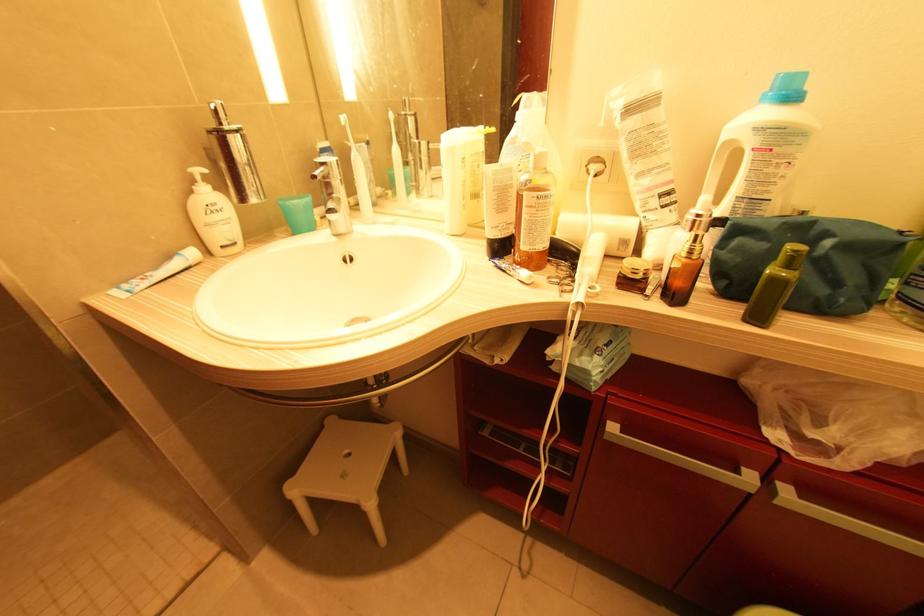
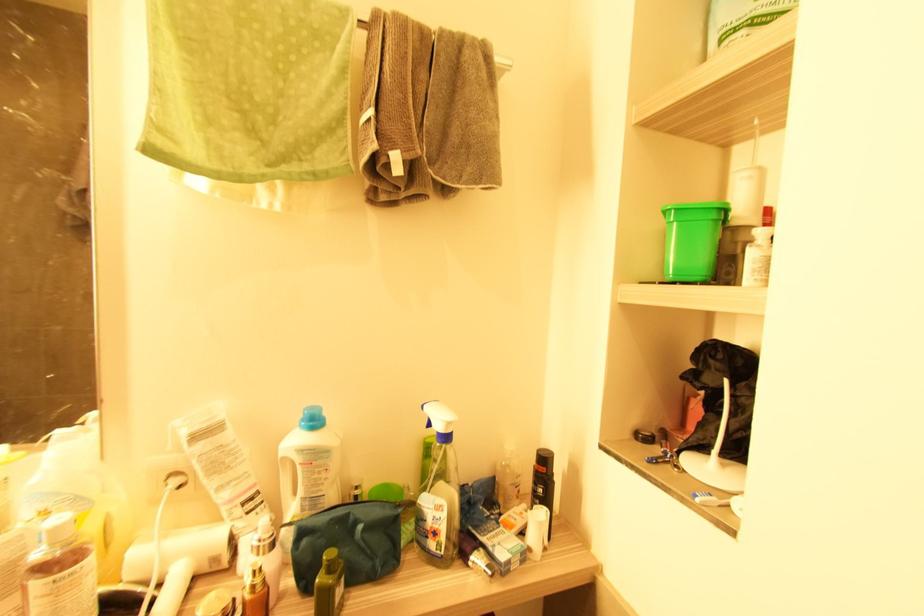
Locate, in the second image, the point that corresponds to point 830,244 in the first image.

(361, 529)